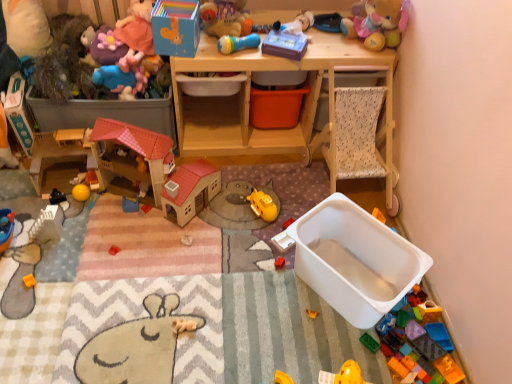
Question: From a real-world perspective, is matte blue rubber duck at upper left, which is counted as the 4th toy, starting from the left, positioned over yellow rubber ball at center-left, the second toy positioned from the left, based on gravity?

Choices:
 (A) no
 (B) yes

Answer: (B)

Question: Is matte blue rubber duck at upper left, which is counted as the 4th toy, starting from the left, in front of yellow rubber ball at center-left, the second toy positioned from the left?

Choices:
 (A) yes
 (B) no

Answer: (A)

Question: Does matte blue rubber duck at upper left, which is counted as the 4th toy, starting from the left, contain yellow rubber ball at center-left, the second toy positioned from the left?

Choices:
 (A) no
 (B) yes

Answer: (A)

Question: Are matte blue rubber duck at upper left, the 9th toy when ordered from right to left, and yellow rubber ball at center-left, which is the 11th toy from right to left, beside each other?

Choices:
 (A) yes
 (B) no

Answer: (B)

Question: Considering the relative sizes of matte blue rubber duck at upper left, the 9th toy when ordered from right to left, and yellow rubber ball at center-left, which is the 11th toy from right to left, in the image provided, is matte blue rubber duck at upper left, the 9th toy when ordered from right to left, taller than yellow rubber ball at center-left, which is the 11th toy from right to left,?

Choices:
 (A) yes
 (B) no

Answer: (A)

Question: From a real-world perspective, relative to matte blue rubber duck at upper left, the 9th toy when ordered from right to left, is white plastic toy at center, arranged as the third toy when viewed from the right, vertically above or below?

Choices:
 (A) above
 (B) below

Answer: (B)

Question: Does point (290, 218) appear closer or farther from the camera than point (144, 86)?

Choices:
 (A) farther
 (B) closer

Answer: (B)

Question: Looking at their shapes, would you say white plastic toy at center, arranged as the third toy when viewed from the right, is wider or thinner than matte blue rubber duck at upper left, the 9th toy when ordered from right to left?

Choices:
 (A) wide
 (B) thin

Answer: (A)

Question: Is white plastic toy at center, arranged as the third toy when viewed from the right, taller or shorter than matte blue rubber duck at upper left, the 9th toy when ordered from right to left?

Choices:
 (A) short
 (B) tall

Answer: (A)

Question: From the image's perspective, relative to blue plastic toy at center, the 5th toy viewed from the left, is rubberized plastic microphone at upper center, which is the eighth toy from left to right, above or below?

Choices:
 (A) above
 (B) below

Answer: (A)

Question: In terms of size, does rubberized plastic microphone at upper center, which is the eighth toy from left to right, appear bigger or smaller than blue plastic toy at center, which ranks as the 8th toy in right-to-left order?

Choices:
 (A) small
 (B) big

Answer: (B)

Question: Is rubberized plastic microphone at upper center, which is the eighth toy from left to right, wider or thinner than blue plastic toy at center, which ranks as the 8th toy in right-to-left order?

Choices:
 (A) wide
 (B) thin

Answer: (B)

Question: From a real-world perspective, is rubberized plastic microphone at upper center, which is counted as the fifth toy, starting from the right, physically located above or below blue plastic toy at center, the 5th toy viewed from the left?

Choices:
 (A) below
 (B) above

Answer: (B)

Question: Does point (265, 215) appear closer or farther from the camera than point (117, 59)?

Choices:
 (A) farther
 (B) closer

Answer: (B)

Question: Is yellow matte submarine at center, which appears as the fourth toy when viewed from the right, wider or thinner than purple plush toy at upper left, which is the third toy in left-to-right order?

Choices:
 (A) thin
 (B) wide

Answer: (A)